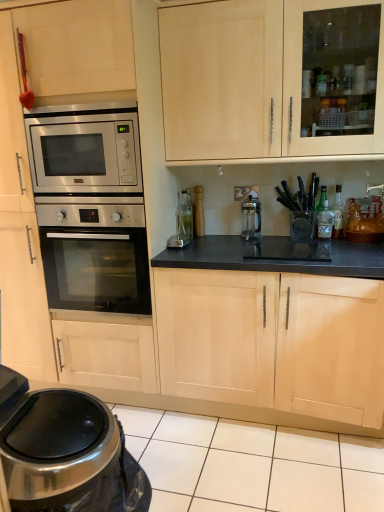
Find the location of a particular element. The width and height of the screenshot is (384, 512). free space in front of clear glass bottle at center-right, the second bottle positioned from the left is located at coordinates (340, 240).